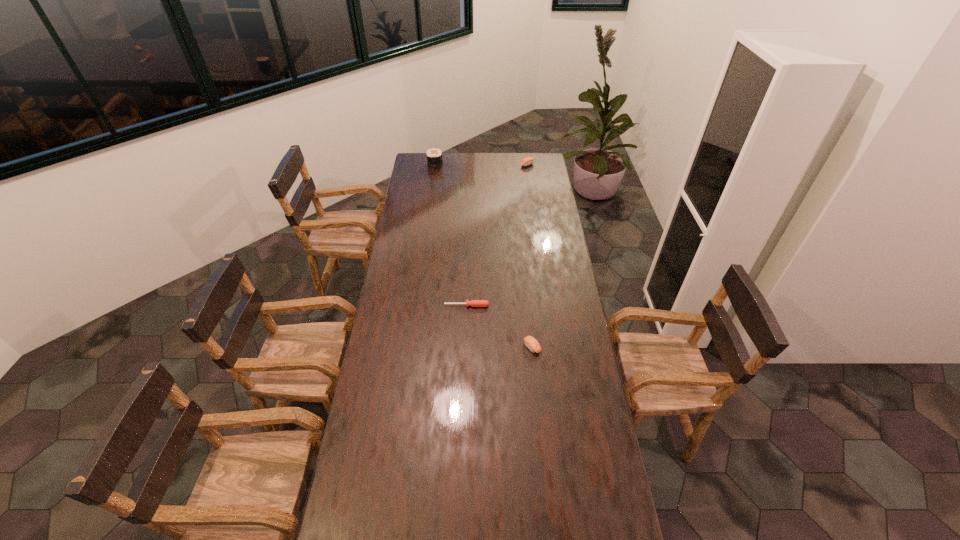
This screenshot has width=960, height=540. I want to click on free space at the far right corner, so click(533, 154).

You are a GUI agent. You are given a task and a screenshot of the screen. Output one action in this format:
    pyautogui.click(x=<x>, y=<y>)
    Task: Click on the vacant space that is in between the leftmost sushi and the third object from left to right
    This screenshot has width=960, height=540.
    Given the screenshot: What is the action you would take?
    pyautogui.click(x=484, y=256)

I want to click on unoccupied area between the screwdriver and the rightmost object, so click(497, 235).

Where is `blank region between the nearest object and the leftmost sushi`? blank region between the nearest object and the leftmost sushi is located at coordinates (484, 256).

Where is `empty space between the second tallest object and the tallest object`? The width and height of the screenshot is (960, 540). empty space between the second tallest object and the tallest object is located at coordinates (481, 165).

Identify the location of unoccupied area between the tallest sushi and the shortest object. (451, 235).

The image size is (960, 540). I want to click on unoccupied position between the leftmost sushi and the second tallest sushi, so click(481, 165).

Where is `unoccupied position between the leftmost sushi and the nearest sushi`? unoccupied position between the leftmost sushi and the nearest sushi is located at coordinates (484, 256).

What are the coordinates of `vacant space that's between the second nearest object and the shortest sushi` in the screenshot? It's located at (499, 326).

Locate an element on the screen. The height and width of the screenshot is (540, 960). blank region between the third farthest object and the leftmost object is located at coordinates (451, 235).